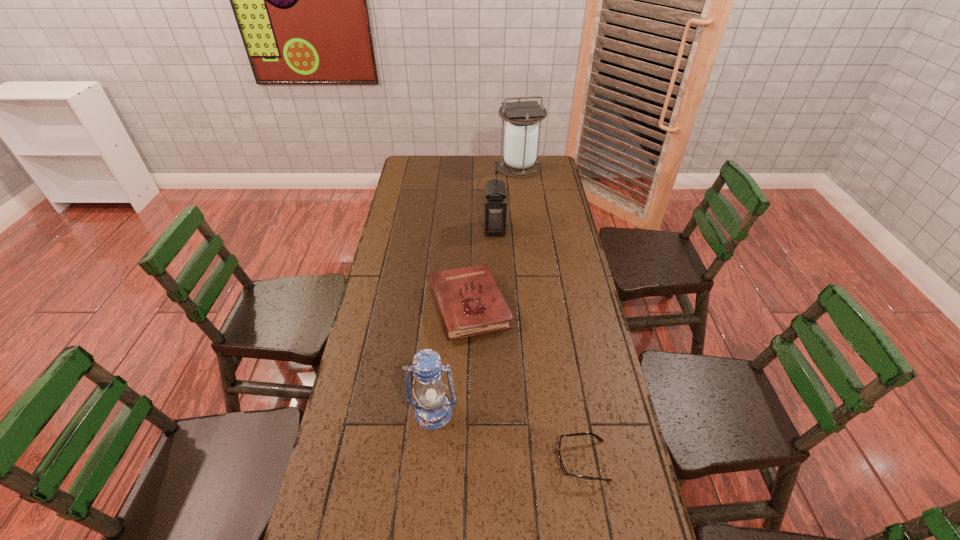
At what (x,y) coordinates should I click in order to perform the action: click on vacant space in between the third nearest object and the nearest lantern. Please return your answer as a coordinate pair (x, y). The image size is (960, 540). Looking at the image, I should click on (451, 359).

Locate an element on the screen. The width and height of the screenshot is (960, 540). free spot between the spectacles and the fourth tallest object is located at coordinates pos(526,383).

The height and width of the screenshot is (540, 960). Find the location of `free point between the nearest lantern and the spectacles`. free point between the nearest lantern and the spectacles is located at coordinates (508, 436).

Identify the location of empty space that is in between the nearest lantern and the spectacles. (508, 436).

The width and height of the screenshot is (960, 540). Identify the location of the closest object relative to the farthest lantern. (495, 206).

Identify which object is the nearest to the second farthest lantern. Please provide its 2D coordinates. Your answer should be formatted as a tuple, i.e. [(x, y)], where the tuple contains the x and y coordinates of a point satisfying the conditions above.

[(470, 302)]

Locate an element on the screen. The height and width of the screenshot is (540, 960). the closest lantern to the second farthest lantern is located at coordinates (521, 132).

What are the coordinates of `lantern that can be found as the closest to the fourth farthest object` in the screenshot? It's located at (495, 206).